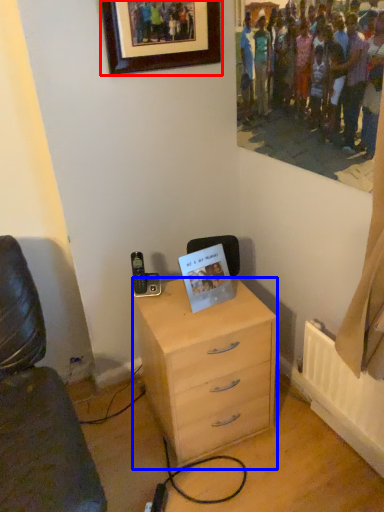
Question: Which object is closer to the camera taking this photo, picture frame (highlighted by a red box) or chest of drawers (highlighted by a blue box)?

Choices:
 (A) picture frame
 (B) chest of drawers

Answer: (A)